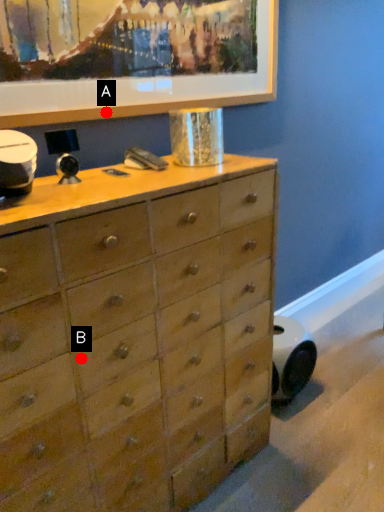
Question: Two points are circled on the image, labeled by A and B beside each circle. Which point appears closest to the camera in this image?

Choices:
 (A) A is closer
 (B) B is closer

Answer: (B)